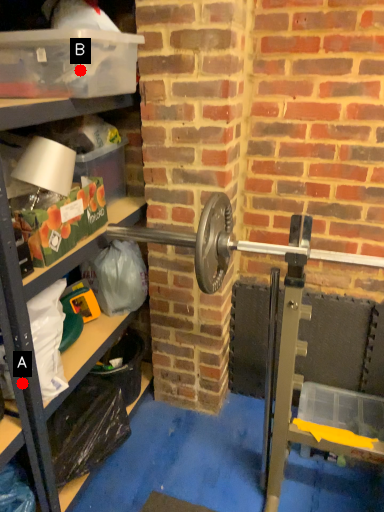
Question: Two points are circled on the image, labeled by A and B beside each circle. Among these points, which one is farthest from the camera?

Choices:
 (A) A is further
 (B) B is further

Answer: (A)